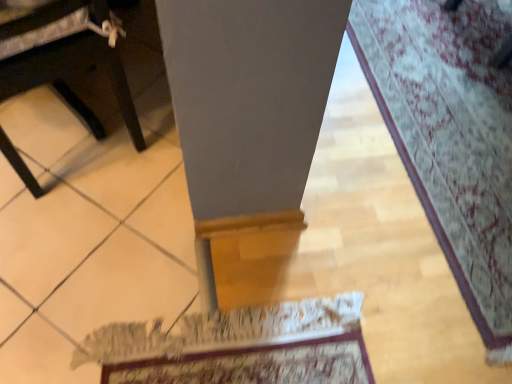
Identify the location of patterned carpet at lower right. (451, 136).

What do you see at coordinates (451, 136) in the screenshot?
I see `patterned carpet at lower right` at bounding box center [451, 136].

Describe the element at coordinates (67, 61) in the screenshot. I see `black plastic table at lower left` at that location.

At what (x,y) coordinates should I click in order to perform the action: click on black plastic table at lower left. Please return your answer as a coordinate pair (x, y). Looking at the image, I should click on (67, 61).

Identify the location of patterned carpet at lower right. The image size is (512, 384). (451, 136).

Is patterned carpet at lower right to the left or to the right of black plastic table at lower left in the image?

From the image, it's evident that patterned carpet at lower right is to the right of black plastic table at lower left.

Which is behind, patterned carpet at lower right or black plastic table at lower left?

patterned carpet at lower right.

Between point (430, 88) and point (116, 71), which one is positioned in front?

The point (116, 71) is more forward.

From the image's perspective, is patterned carpet at lower right on black plastic table at lower left?

No, from the image's perspective, patterned carpet at lower right is not over black plastic table at lower left.

From a real-world perspective, does patterned carpet at lower right sit lower than black plastic table at lower left?

Yes, from a real-world perspective, patterned carpet at lower right is beneath black plastic table at lower left.

Can you confirm if patterned carpet at lower right is wider than black plastic table at lower left?

Correct, the width of patterned carpet at lower right exceeds that of black plastic table at lower left.

Which of these two, patterned carpet at lower right or black plastic table at lower left, stands shorter?

With less height is patterned carpet at lower right.

Which of these two, patterned carpet at lower right or black plastic table at lower left, is smaller?

Smaller between the two is patterned carpet at lower right.

Would you say black plastic table at lower left is part of patterned carpet at lower right's contents?

No.

Is patterned carpet at lower right positioned far away from black plastic table at lower left?

Absolutely, patterned carpet at lower right is distant from black plastic table at lower left.

Is patterned carpet at lower right looking in the opposite direction of black plastic table at lower left?

No, patterned carpet at lower right's orientation is not away from black plastic table at lower left.

Consider the image. How many degrees apart are the facing directions of patterned carpet at lower right and black plastic table at lower left?

The angular difference between patterned carpet at lower right and black plastic table at lower left is 158 degrees.

How distant is patterned carpet at lower right from black plastic table at lower left?

patterned carpet at lower right is 1.10 meters from black plastic table at lower left.

Find the location of a particular element. The image size is (512, 384). furniture above the patterned carpet at lower right (from a real-world perspective) is located at coordinates (67, 61).

Is black plastic table at lower left to the right of patterned carpet at lower right from the viewer's perspective?

Incorrect, black plastic table at lower left is not on the right side of patterned carpet at lower right.

Which object is closer to the camera taking this photo, black plastic table at lower left or patterned carpet at lower right?

black plastic table at lower left is in front.

Does point (79, 65) come in front of point (470, 59)?

That is True.

From the image's perspective, relative to patterned carpet at lower right, is black plastic table at lower left above or below?

Based on their image positions, black plastic table at lower left is located above patterned carpet at lower right.

From a real-world perspective, which object rests below the other?

patterned carpet at lower right is physically lower.

In terms of width, does black plastic table at lower left look wider or thinner when compared to patterned carpet at lower right?

In the image, black plastic table at lower left appears to be more narrow than patterned carpet at lower right.

Which of these two, black plastic table at lower left or patterned carpet at lower right, stands taller?

Standing taller between the two is black plastic table at lower left.

In terms of size, does black plastic table at lower left appear bigger or smaller than patterned carpet at lower right?

Considering their sizes, black plastic table at lower left takes up more space than patterned carpet at lower right.

Which is correct: black plastic table at lower left is inside patterned carpet at lower right, or outside of it?

black plastic table at lower left is located beyond the bounds of patterned carpet at lower right.

Is black plastic table at lower left positioned far away from patterned carpet at lower right?

Indeed, black plastic table at lower left is not near patterned carpet at lower right.

Could you tell me if black plastic table at lower left is facing patterned carpet at lower right?

No, black plastic table at lower left is not turned towards patterned carpet at lower right.

The width and height of the screenshot is (512, 384). Find the location of `mat below the black plastic table at lower left (from the image's perspective)`. mat below the black plastic table at lower left (from the image's perspective) is located at coordinates (451, 136).

What are the coordinates of `mat below the black plastic table at lower left (from the image's perspective)` in the screenshot? It's located at (451, 136).

This screenshot has width=512, height=384. Identify the location of mat behind the black plastic table at lower left. (451, 136).